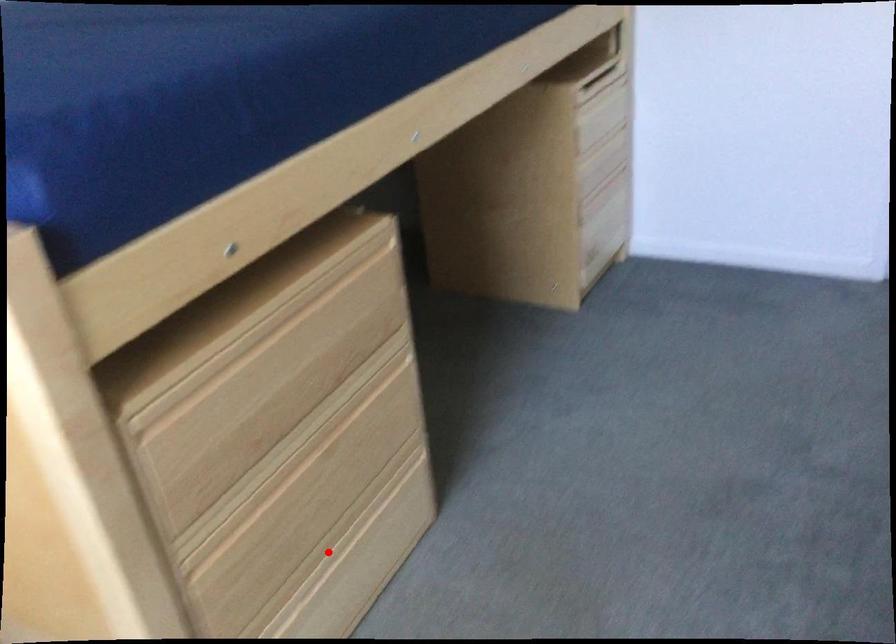
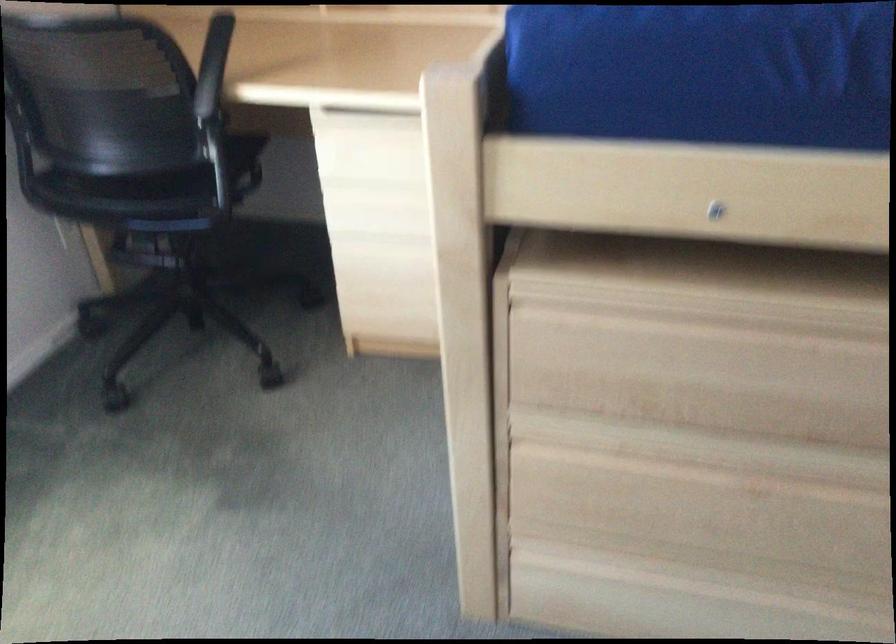
Question: I am providing you with two images of the same scene from different viewpoints. A red point is shown in image1. For the corresponding object point in image2, is it positioned nearer or farther from the camera?

Choices:
 (A) Nearer
 (B) Farther

Answer: (A)